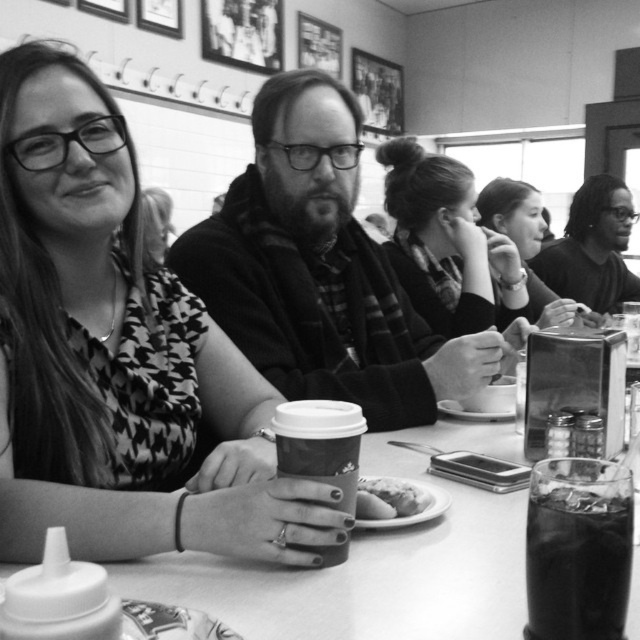
Does dark glass at lower right appear over smooth black hair at right?

Incorrect, dark glass at lower right is not positioned above smooth black hair at right.

Who is taller, dark glass at lower right or smooth black hair at right?

Standing taller between the two is smooth black hair at right.

Is point (596, 570) in front of point (593, 273)?

Yes, it is.

Locate an element on the screen. The image size is (640, 640). dark glass at lower right is located at coordinates (577, 548).

Is smooth plastic cup at center further to camera compared to soft wool scarf at center?

No, smooth plastic cup at center is closer to the viewer.

Between smooth plastic cup at center and soft wool scarf at center, which one has more height?

soft wool scarf at center is taller.

Who is more distant from viewer, (x=387, y=636) or (x=392, y=168)?

Point (x=392, y=168)

Where is `smooth plastic cup at center`? smooth plastic cup at center is located at coordinates (376, 563).

The width and height of the screenshot is (640, 640). I want to click on matte black hoodie at center, so click(321, 269).